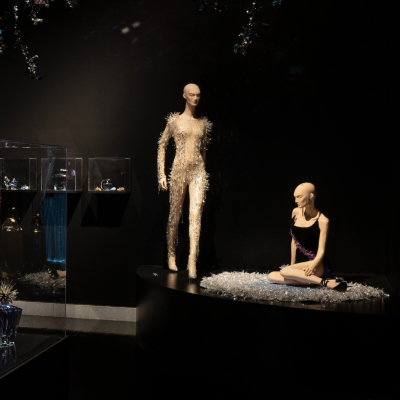
Identify the location of pedestal. The width and height of the screenshot is (400, 400). (263, 349).